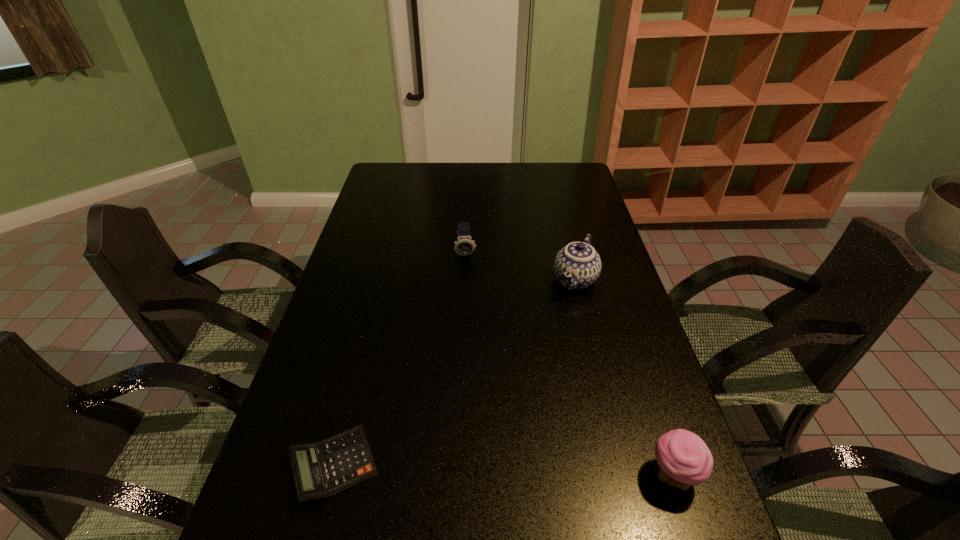
The width and height of the screenshot is (960, 540). Identify the location of the shortest object. (320, 470).

The height and width of the screenshot is (540, 960). What are the coordinates of `the leftmost object` in the screenshot? It's located at (320, 470).

Where is `cupcake`? This screenshot has height=540, width=960. cupcake is located at coordinates (684, 460).

Identify the location of the third object from right to left. This screenshot has width=960, height=540. (464, 246).

Image resolution: width=960 pixels, height=540 pixels. Identify the location of chinaware. (577, 266).

The height and width of the screenshot is (540, 960). I want to click on free region located 0.170m on the back of the leftmost object, so coord(359,367).

Where is `blank space located on the left of the cupcake`? The width and height of the screenshot is (960, 540). blank space located on the left of the cupcake is located at coordinates [x=493, y=475].

This screenshot has height=540, width=960. What are the coordinates of `blank space located 0.400m on the face of the second object from left to right` in the screenshot? It's located at (473, 360).

Identify the location of vacant space positioned on the face of the second object from left to right. This screenshot has height=540, width=960. (469, 306).

You are a GUI agent. You are given a task and a screenshot of the screen. Output one action in this format:
    pyautogui.click(x=<x>, y=<y>)
    Task: Click on the vacant area situated on the face of the second object from left to right
    This screenshot has width=960, height=540.
    Given the screenshot: What is the action you would take?
    click(468, 286)